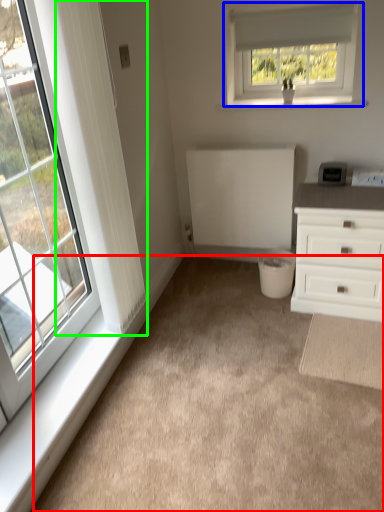
Question: Estimate the real-world distances between objects in this image. Which object is closer to plain (highlighted by a red box), window (highlighted by a blue box) or curtain (highlighted by a green box)?

Choices:
 (A) window
 (B) curtain

Answer: (B)